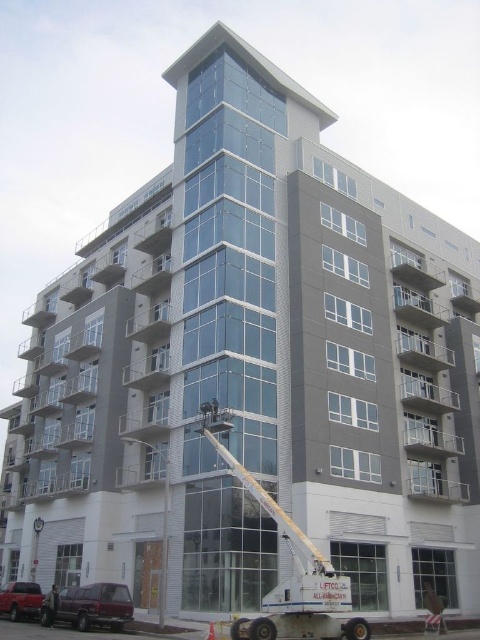
Question: Which object appears closest to the camera in this image?

Choices:
 (A) dark gray uniform at lower left
 (B) maroon metallic van at lower left
 (C) metallic red van at lower left

Answer: (B)

Question: Can you confirm if maroon metallic van at lower left is thinner than metallic red van at lower left?

Choices:
 (A) no
 (B) yes

Answer: (B)

Question: Which object appears closest to the camera in this image?

Choices:
 (A) metallic red van at lower left
 (B) dark gray uniform at lower left

Answer: (B)

Question: Which point is closer to the camera taking this photo?

Choices:
 (A) (21, 595)
 (B) (45, 625)
 (C) (73, 600)

Answer: (C)

Question: Can you confirm if metallic red van at lower left is bigger than dark gray uniform at lower left?

Choices:
 (A) no
 (B) yes

Answer: (B)

Question: Does metallic red van at lower left appear on the left side of dark gray uniform at lower left?

Choices:
 (A) no
 (B) yes

Answer: (B)